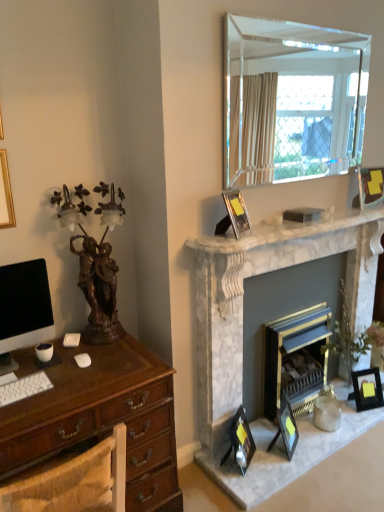
Question: Does white marble fireplace at center, positioned as the second fireplace in right-to-left order, have a greater height compared to clear glass mirror at upper right?

Choices:
 (A) yes
 (B) no

Answer: (A)

Question: Does white marble fireplace at center, positioned as the 1th fireplace in left-to-right order, have a smaller size compared to clear glass mirror at upper right?

Choices:
 (A) no
 (B) yes

Answer: (A)

Question: Does white marble fireplace at center, positioned as the 1th fireplace in left-to-right order, touch clear glass mirror at upper right?

Choices:
 (A) no
 (B) yes

Answer: (A)

Question: Can you confirm if white marble fireplace at center, positioned as the second fireplace in right-to-left order, is positioned to the left of clear glass mirror at upper right?

Choices:
 (A) yes
 (B) no

Answer: (B)

Question: Can you confirm if white marble fireplace at center, positioned as the 1th fireplace in left-to-right order, is shorter than clear glass mirror at upper right?

Choices:
 (A) yes
 (B) no

Answer: (B)

Question: Are white marble fireplace at center, positioned as the second fireplace in right-to-left order, and clear glass mirror at upper right far apart?

Choices:
 (A) yes
 (B) no

Answer: (B)

Question: Does clear glass mirror at upper right have a greater width compared to white marble fireplace at center, positioned as the 1th fireplace in left-to-right order?

Choices:
 (A) yes
 (B) no

Answer: (B)

Question: Does clear glass mirror at upper right lie in front of white marble fireplace at center, positioned as the 1th fireplace in left-to-right order?

Choices:
 (A) yes
 (B) no

Answer: (A)

Question: Is clear glass mirror at upper right outside white marble fireplace at center, positioned as the 1th fireplace in left-to-right order?

Choices:
 (A) no
 (B) yes

Answer: (B)

Question: Does clear glass mirror at upper right have a lesser width compared to white marble fireplace at center, positioned as the 1th fireplace in left-to-right order?

Choices:
 (A) yes
 (B) no

Answer: (A)

Question: Is white marble fireplace at center, positioned as the 1th fireplace in left-to-right order, inside clear glass mirror at upper right?

Choices:
 (A) no
 (B) yes

Answer: (A)

Question: Can you confirm if clear glass mirror at upper right is positioned to the left of white marble fireplace at center, positioned as the 1th fireplace in left-to-right order?

Choices:
 (A) yes
 (B) no

Answer: (A)

Question: Is there a large distance between white marble fireplace at upper center and matte black monitor at left?

Choices:
 (A) no
 (B) yes

Answer: (A)